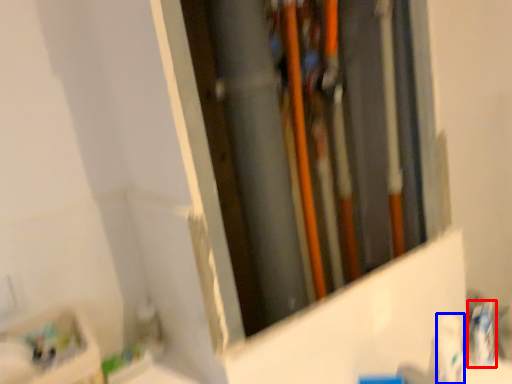
Question: Which of the following is the farthest to the observer, toothpaste (highlighted by a red box) or toiletry (highlighted by a blue box)?

Choices:
 (A) toothpaste
 (B) toiletry

Answer: (A)